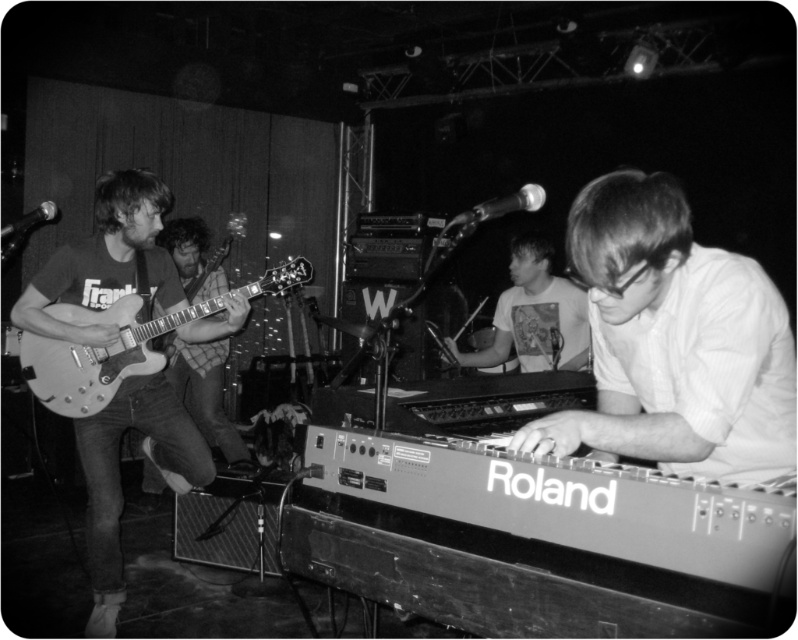
You are a photographer standing at the front of the stage. You want to take a photo that includes both the Roland keyboard and the electric guitar. Which of the two points, point (x=791, y=456) or point (x=469, y=360), is closer to your camera position?

Point (x=791, y=456) is closer to the camera than point (x=469, y=360), so you should position your camera closer to that point to capture both instruments in focus.